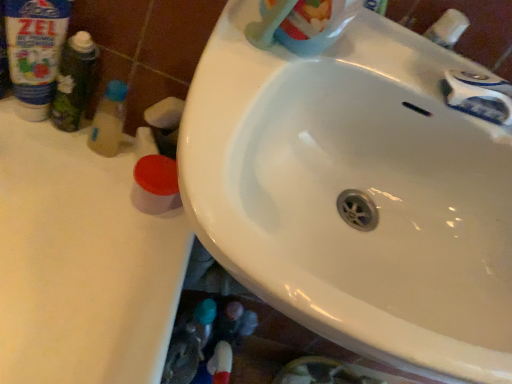
Question: Is white plastic faucet at upper right with green matte bottle at left, acting as the first toiletry starting from the left?

Choices:
 (A) yes
 (B) no

Answer: (B)

Question: Is the position of white plastic faucet at upper right less distant than that of green matte bottle at left, acting as the first toiletry starting from the left?

Choices:
 (A) yes
 (B) no

Answer: (A)

Question: Does white plastic faucet at upper right have a smaller size compared to green matte bottle at left, the second toiletry in the right-to-left sequence?

Choices:
 (A) no
 (B) yes

Answer: (B)

Question: Is white plastic faucet at upper right turned away from green matte bottle at left, acting as the first toiletry starting from the left?

Choices:
 (A) no
 (B) yes

Answer: (A)

Question: Can you confirm if white plastic faucet at upper right is bigger than green matte bottle at left, acting as the first toiletry starting from the left?

Choices:
 (A) no
 (B) yes

Answer: (A)

Question: Does white plastic faucet at upper right contain green matte bottle at left, the second toiletry in the right-to-left sequence?

Choices:
 (A) yes
 (B) no

Answer: (B)

Question: Is green matte bottle at left, the second toiletry in the right-to-left sequence, looking in the opposite direction of white glossy sink at center?

Choices:
 (A) no
 (B) yes

Answer: (A)

Question: Can you confirm if green matte bottle at left, acting as the first toiletry starting from the left, is thinner than white glossy sink at center?

Choices:
 (A) no
 (B) yes

Answer: (B)

Question: Does green matte bottle at left, acting as the first toiletry starting from the left, come in front of white glossy sink at center?

Choices:
 (A) yes
 (B) no

Answer: (B)

Question: Does green matte bottle at left, acting as the first toiletry starting from the left, have a greater height compared to white glossy sink at center?

Choices:
 (A) no
 (B) yes

Answer: (A)

Question: Would you say white glossy sink at center is part of green matte bottle at left, the second toiletry in the right-to-left sequence,'s contents?

Choices:
 (A) yes
 (B) no

Answer: (B)

Question: Considering the relative sizes of green matte bottle at left, acting as the first toiletry starting from the left, and white glossy sink at center in the image provided, is green matte bottle at left, acting as the first toiletry starting from the left, shorter than white glossy sink at center?

Choices:
 (A) yes
 (B) no

Answer: (A)

Question: Is translucent plastic bottle at left, marked as the second toiletry in a left-to-right arrangement, to the left of green matte bottle at left, the second toiletry in the right-to-left sequence, from the viewer's perspective?

Choices:
 (A) no
 (B) yes

Answer: (A)